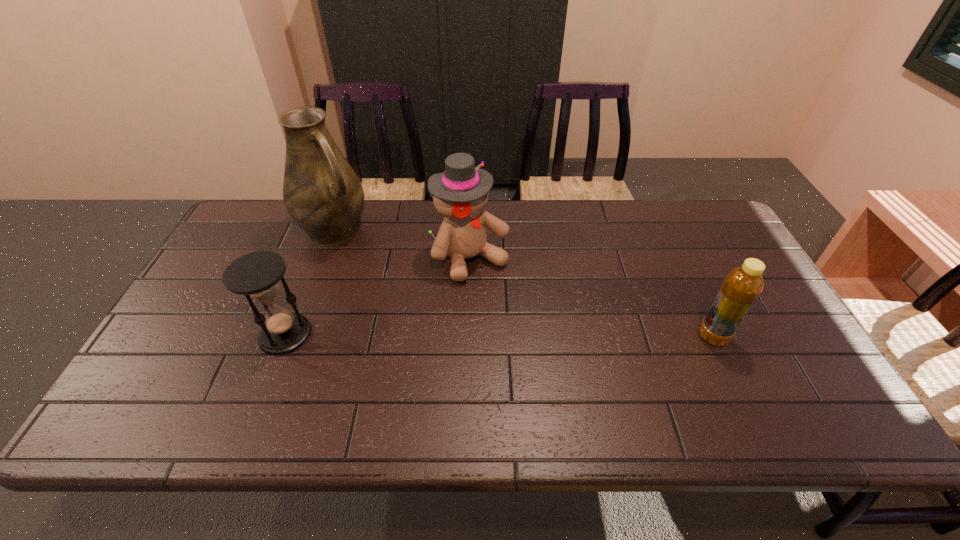
At what (x,y) coordinates should I click in order to perform the action: click on vacant area that lies between the third shortest object and the pitcher. Please return your answer as a coordinate pair (x, y). Looking at the image, I should click on (402, 244).

The height and width of the screenshot is (540, 960). What are the coordinates of `vacant area that lies between the pitcher and the bottle` in the screenshot? It's located at (523, 282).

This screenshot has width=960, height=540. Find the location of `free space between the rag_doll and the hourglass`. free space between the rag_doll and the hourglass is located at coordinates (378, 296).

This screenshot has height=540, width=960. I want to click on vacant point located between the hourglass and the third object from left to right, so (x=378, y=296).

I want to click on free spot between the rag_doll and the hourglass, so click(378, 296).

Find the location of `empty location between the rag_doll and the hourglass`. empty location between the rag_doll and the hourglass is located at coordinates (378, 296).

This screenshot has height=540, width=960. I want to click on empty space that is in between the rightmost object and the hourglass, so click(499, 335).

At what (x,y) coordinates should I click in order to perform the action: click on free space between the pitcher and the hourglass. Please return your answer as a coordinate pair (x, y). Looking at the image, I should click on (310, 281).

At what (x,y) coordinates should I click in order to perform the action: click on free space between the tallest object and the third object from left to right. Please return your answer as a coordinate pair (x, y). Looking at the image, I should click on (402, 244).

The image size is (960, 540). Identify the location of free space between the bottle and the pitcher. (523, 282).